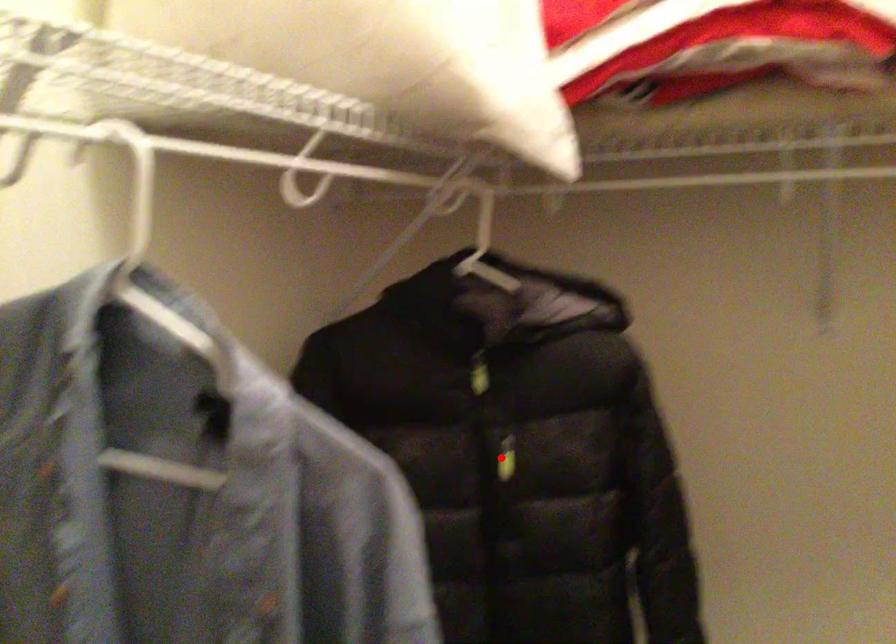
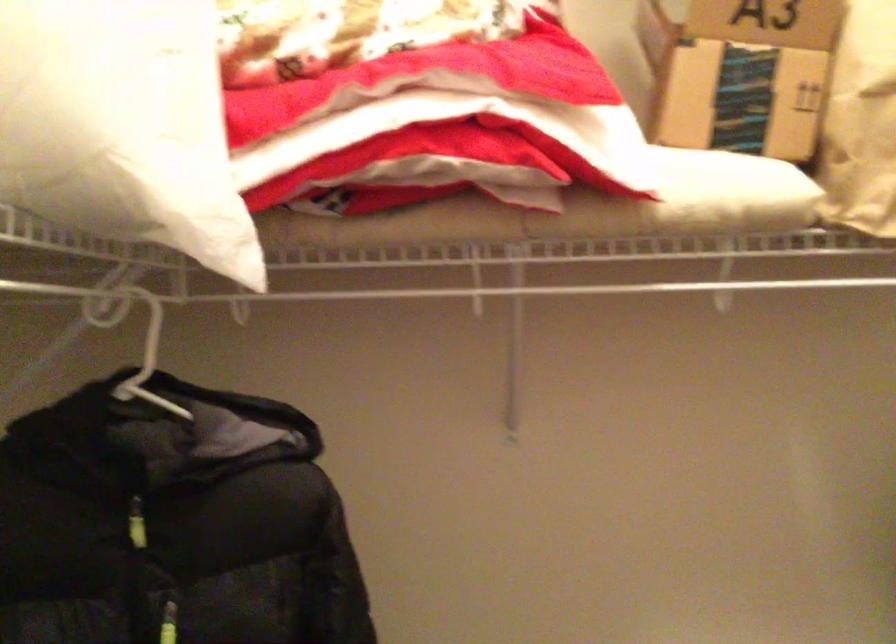
Question: I am providing you with two images of the same scene from different viewpoints. A red point is shown in image1. For the corresponding object point in image2, is it positioned nearer or farther from the camera?

Choices:
 (A) Nearer
 (B) Farther

Answer: (A)